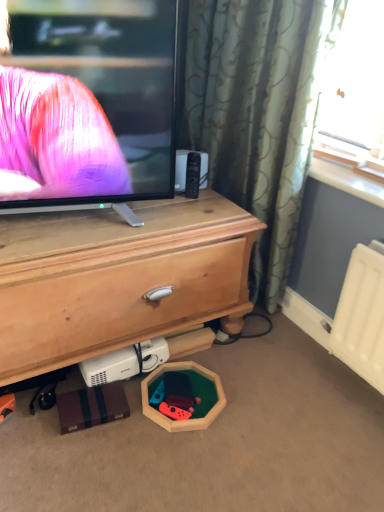
Where is `blank space situated above wooden hexagon at lower center, which ranks as the second toy in left-to-right order (from a real-world perspective)`? The height and width of the screenshot is (512, 384). blank space situated above wooden hexagon at lower center, which ranks as the second toy in left-to-right order (from a real-world perspective) is located at coordinates (171, 402).